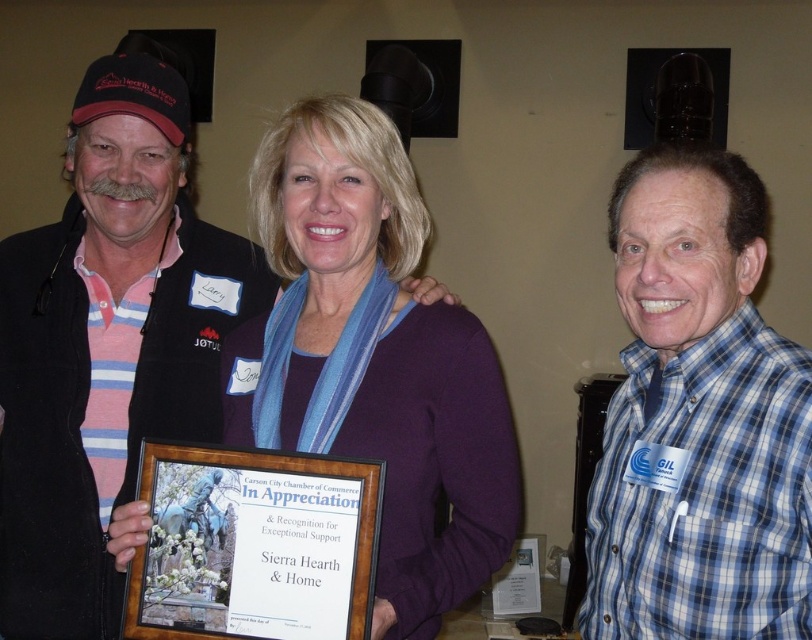
Question: Based on their relative distances, which object is nearer to the blue plaid shirt at right?

Choices:
 (A) purple fabric scarf at center
 (B) striped polo shirt at left

Answer: (A)

Question: Can you confirm if blue plaid shirt at right is positioned to the right of purple fabric scarf at center?

Choices:
 (A) yes
 (B) no

Answer: (A)

Question: Does striped polo shirt at left appear on the right side of purple fabric scarf at center?

Choices:
 (A) yes
 (B) no

Answer: (B)

Question: Which of the following is the closest to the observer?

Choices:
 (A) striped polo shirt at left
 (B) blue plaid shirt at right

Answer: (B)

Question: Does blue plaid shirt at right appear on the left side of purple fabric scarf at center?

Choices:
 (A) no
 (B) yes

Answer: (A)

Question: Which point is farther from the camera taking this photo?

Choices:
 (A) (335, 221)
 (B) (91, 179)

Answer: (B)